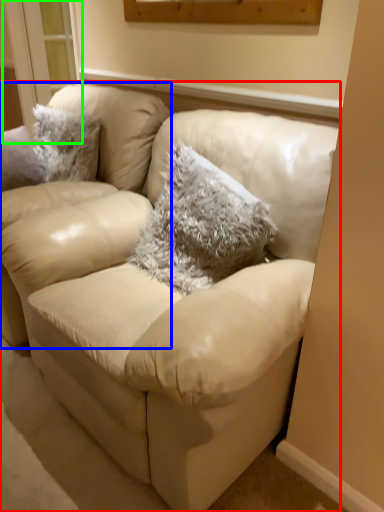
Question: Which object is the farthest from studio couch (highlighted by a red box)? Choose among these: chair (highlighted by a blue box) or window (highlighted by a green box).

Choices:
 (A) chair
 (B) window

Answer: (B)